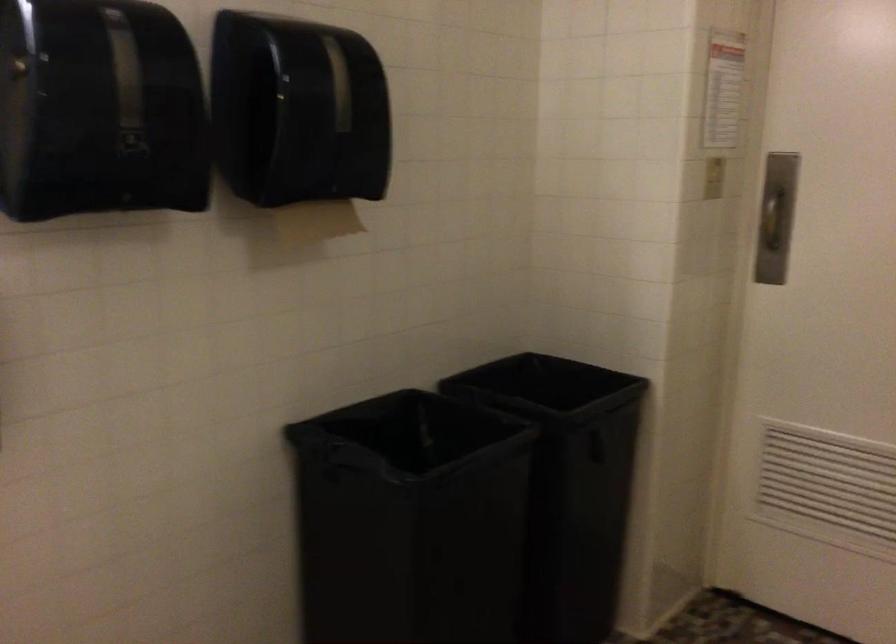
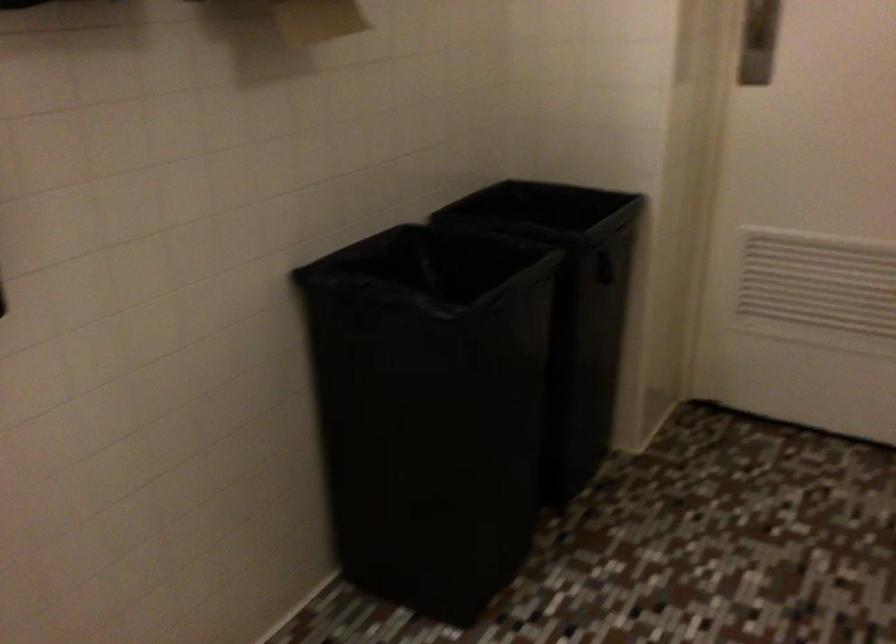
Question: Based on the continuous images, in which direction is the camera rotating? Reply with the corresponding letter.

Choices:
 (A) Left
 (B) Right
 (C) Up
 (D) Down

Answer: (D)